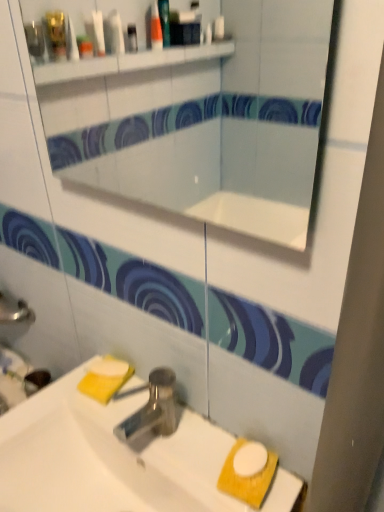
You are a GUI agent. You are given a task and a screenshot of the screen. Output one action in this format:
    pyautogui.click(x=<x>, y=<y>)
    Task: Click on the free space that is to the left of polished metallic tap at center
    
    Given the screenshot: What is the action you would take?
    pyautogui.click(x=73, y=407)